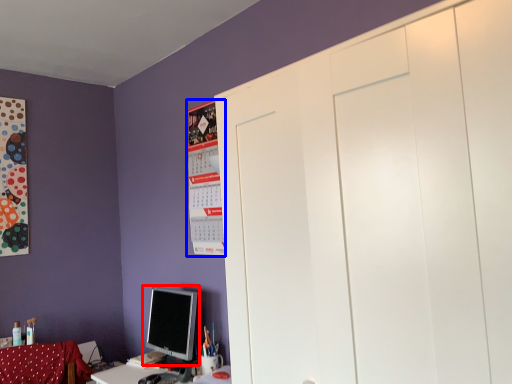
Question: Which object appears closest to the camera in this image, computer monitor (highlighted by a red box) or bulletin board (highlighted by a blue box)?

Choices:
 (A) computer monitor
 (B) bulletin board

Answer: (A)